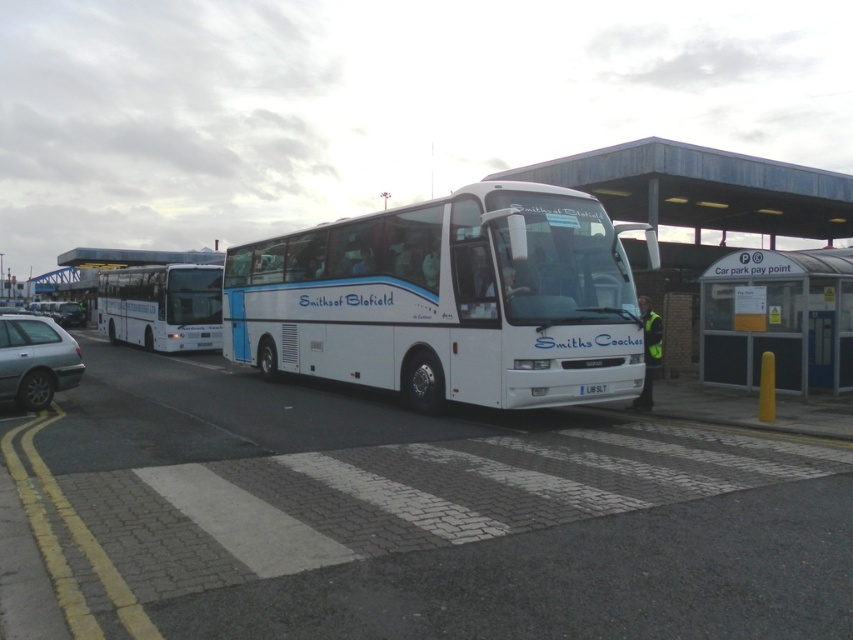
Question: Which object is the farthest from the white glossy bus at center?

Choices:
 (A) white plastic license plate at center
 (B) white matte bus at center
 (C) silver metallic hatchback at lower left
 (D) metallic gray bus stop at lower right

Answer: (D)

Question: Estimate the real-world distances between objects in this image. Which object is closer to the white matte bus at center?

Choices:
 (A) white plastic license plate at center
 (B) white glossy bus at center

Answer: (A)

Question: Is the position of white matte bus at center more distant than that of metallic gray bus stop at lower right?

Choices:
 (A) no
 (B) yes

Answer: (A)

Question: Which point is closer to the camera?

Choices:
 (A) white glossy coach at center
 (B) metallic gray bus stop at lower right
 (C) white plastic bus at center

Answer: (A)

Question: Does white matte bus at center have a lesser width compared to white glossy bus at center?

Choices:
 (A) no
 (B) yes

Answer: (A)

Question: In this image, where is metallic gray bus stop at lower right located relative to silver metallic hatchback at lower left?

Choices:
 (A) right
 (B) left

Answer: (A)